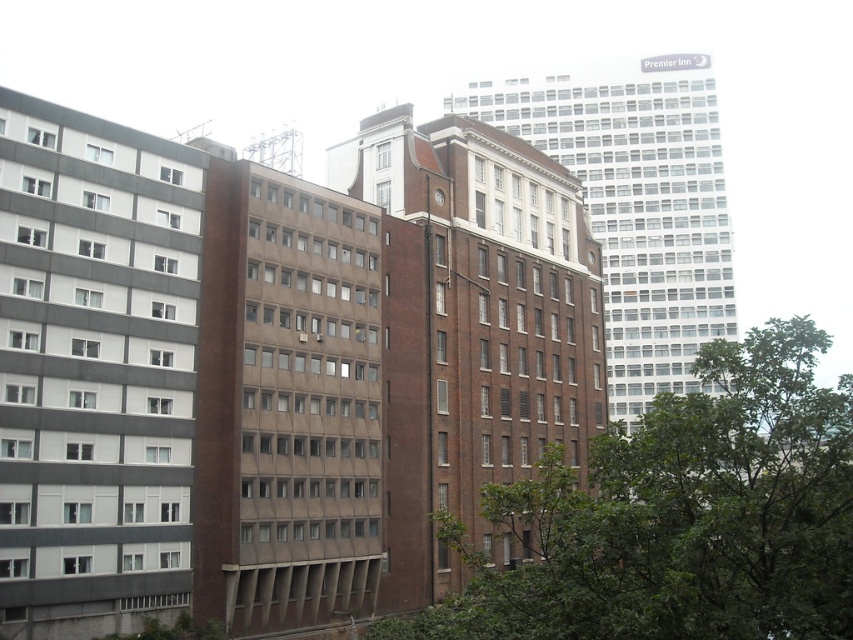
Question: Is brown brick building at center wider than metallic clock at center?

Choices:
 (A) no
 (B) yes

Answer: (B)

Question: Can you confirm if brown brick building at center is positioned to the right of metallic clock at center?

Choices:
 (A) no
 (B) yes

Answer: (B)

Question: Which object appears farthest from the camera in this image?

Choices:
 (A) brown brick building at center
 (B) green leafy tree at center
 (C) metallic clock at center

Answer: (A)

Question: Which of these objects is positioned farthest from the green leafy tree at center?

Choices:
 (A) metallic clock at center
 (B) brown brick building at center

Answer: (A)

Question: Among these points, which one is farthest from the camera?

Choices:
 (A) (442, 198)
 (B) (784, 568)
 (C) (648, 396)

Answer: (C)

Question: Observing the image, what is the correct spatial positioning of green leafy tree at center in reference to metallic clock at center?

Choices:
 (A) below
 (B) above

Answer: (A)